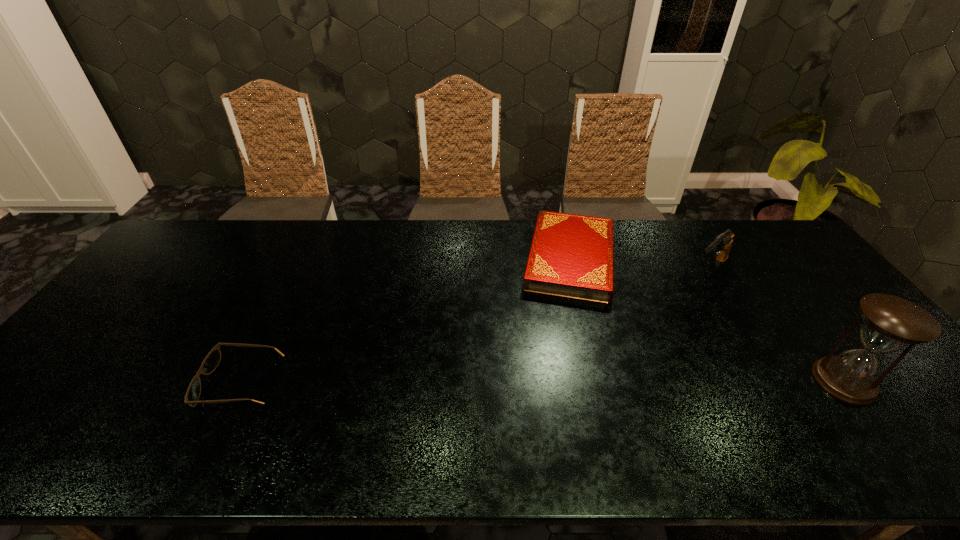
Find the location of a particular element. The width and height of the screenshot is (960, 540). vacant area that lies between the hardback book and the second tallest object is located at coordinates (640, 264).

Identify the location of empty location between the third object from left to right and the tallest object. This screenshot has width=960, height=540. (777, 325).

Identify the location of vacant area that lies between the third shortest object and the hourglass. (777, 325).

The height and width of the screenshot is (540, 960). Identify the location of free spot between the tallest object and the second tallest object. (777, 325).

Identify the location of empty space between the hourglass and the sunglasses. The image size is (960, 540). (542, 382).

You are a GUI agent. You are given a task and a screenshot of the screen. Output one action in this format:
    pyautogui.click(x=<x>, y=<y>)
    Task: Click on the vacant area between the second object from right to left and the hourglass
    The image size is (960, 540).
    Given the screenshot: What is the action you would take?
    pyautogui.click(x=777, y=325)

Image resolution: width=960 pixels, height=540 pixels. I want to click on vacant region between the sunglasses and the hourglass, so click(542, 382).

Point out which object is positioned as the third nearest to the leftmost object. Please provide its 2D coordinates. Your answer should be formatted as a tuple, i.e. [(x, y)], where the tuple contains the x and y coordinates of a point satisfying the conditions above.

[(890, 323)]

Find the location of a particular element. object that is the nearest to the tallest object is located at coordinates (722, 244).

At what (x,y) coordinates should I click in order to perform the action: click on vacant space that satisfies the following two spatial constraints: 1. on the front side of the hardback book; 2. on the right side of the gun. Please return your answer as a coordinate pair (x, y). Looking at the image, I should click on (573, 269).